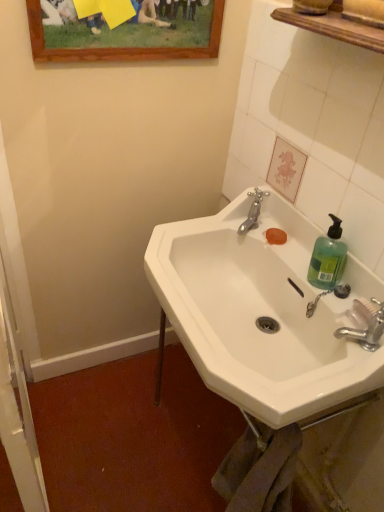
Question: Based on their positions, is wooden picture frame at upper center located to the left or right of silver metallic faucet at lower right, which ranks as the 1th tap in front-to-back order?

Choices:
 (A) right
 (B) left

Answer: (B)

Question: From the image's perspective, is wooden picture frame at upper center positioned above or below silver metallic faucet at lower right, which ranks as the 1th tap in front-to-back order?

Choices:
 (A) below
 (B) above

Answer: (B)

Question: Which object is the farthest from the wooden picture frame at upper center?

Choices:
 (A) green translucent plastic at right
 (B) white glossy screen door at left
 (C) silver metallic faucet at lower right, the second tap from the top
 (D) silver metallic faucet at upper center, arranged as the 2th tap when viewed from the front
 (E) white ceramic sink at center

Answer: (C)

Question: Which of these objects is positioned closest to the silver metallic faucet at lower right, the first tap positioned from the right?

Choices:
 (A) wooden picture frame at upper center
 (B) silver metallic faucet at upper center, placed as the second tap when sorted from right to left
 (C) white glossy screen door at left
 (D) white ceramic sink at center
 (E) green translucent plastic at right

Answer: (E)